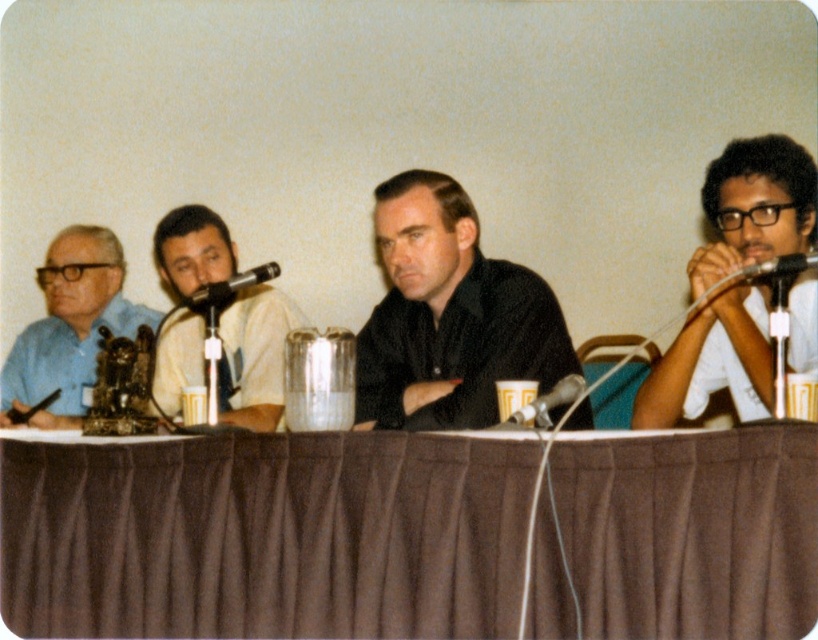
Looking at this image, you are attending a conference and need to speak next. You are currently standing behind the black metallic microphone at center. Where is the metallic silver microphone at upper right relative to your current position?

The metallic silver microphone at upper right is located above the black metallic microphone at center.

You are a photographer standing in front of the panel discussion setup. You need to focus your camera on both the point at [727,150] and the point at [82,241]. Which point should you focus on first to ensure the closest object is in sharp focus?

You should focus on point [727,150] first because it is closer to the viewer than point [82,241], ensuring the closest object is in sharp focus.

You are organizing a panel discussion and need to ensure that the black metallic microphone at center can fit on the brown fabric table at center. Based on the provided information, can you confirm if the microphone will fit on the table?

The brown fabric table at center might be wider than black metallic microphone at center, so there is a possibility that the microphone can fit on the table. However, the exact dimensions are not provided, so further measurements would be needed to confirm.